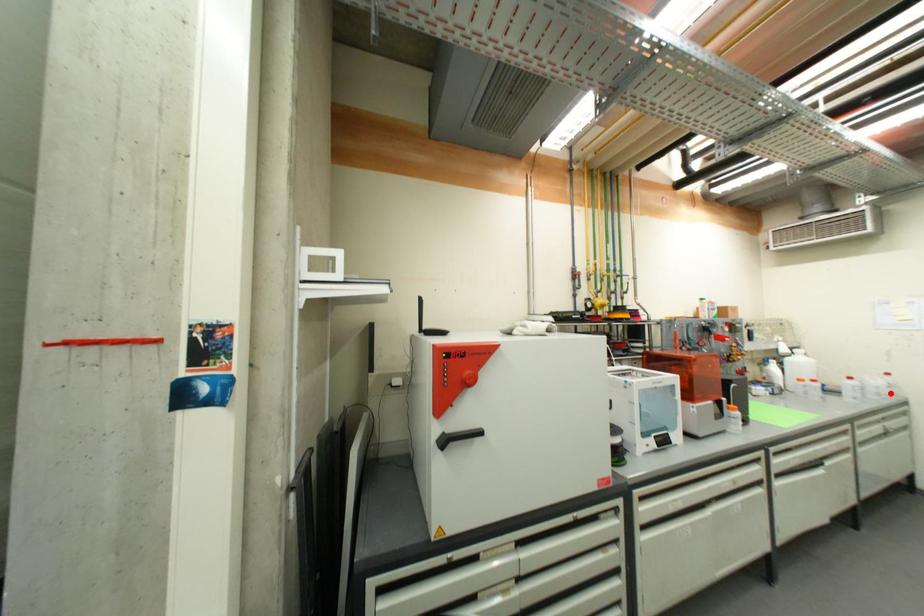
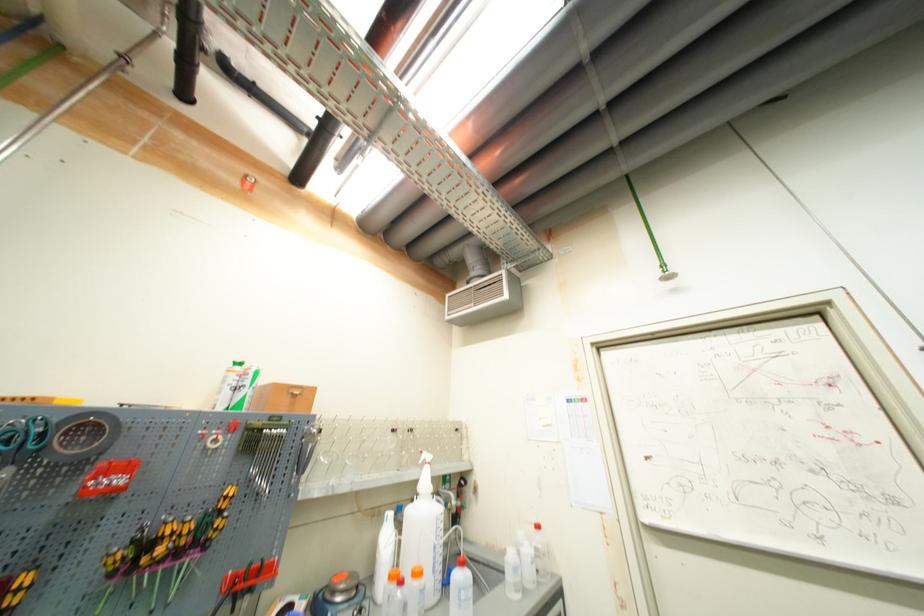
Locate, in the second image, the point that corresponds to the highlighted location in the first image.

(533, 578)